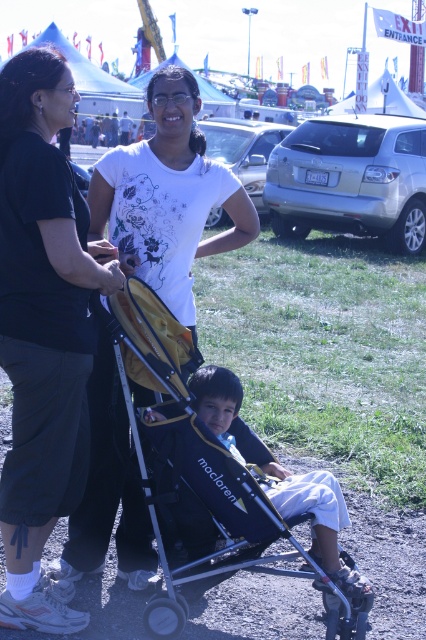
Question: Which point appears closest to the camera in this image?

Choices:
 (A) (112, 154)
 (B) (146, 317)
 (C) (72, 220)

Answer: (C)

Question: Which is nearer to the black cotton shirt at upper left?

Choices:
 (A) yellow fabric stroller at center
 (B) black fabric shirt at center

Answer: (A)

Question: Where is black cotton shirt at upper left located in relation to black fabric shirt at center in the image?

Choices:
 (A) above
 (B) below

Answer: (B)

Question: Among these objects, which one is farthest from the camera?

Choices:
 (A) yellow fabric stroller at center
 (B) black cotton shirt at upper left
 (C) black fabric shirt at center

Answer: (C)

Question: Can you confirm if black cotton shirt at upper left is positioned to the left of black fabric shirt at center?

Choices:
 (A) no
 (B) yes

Answer: (B)

Question: Does black cotton shirt at upper left come in front of black fabric shirt at center?

Choices:
 (A) yes
 (B) no

Answer: (A)